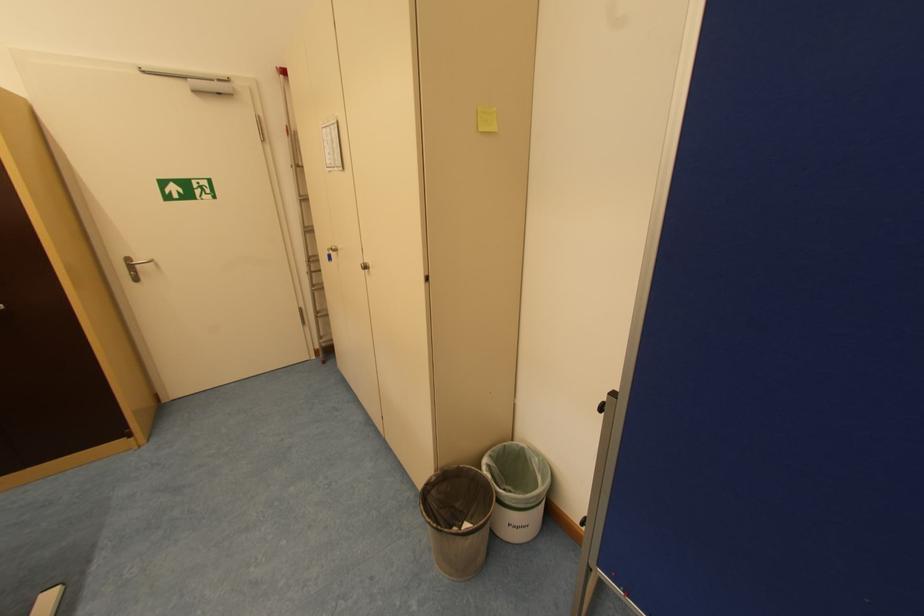
Where would you pull the silver door handle? Please return your answer as a coordinate pair (x, y).

(137, 257)